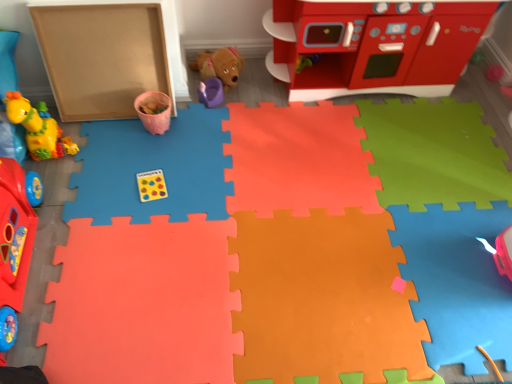
Image resolution: width=512 pixels, height=384 pixels. I want to click on free space in front of pink matte cup at upper center, acting as the third toy starting from the left, so click(144, 158).